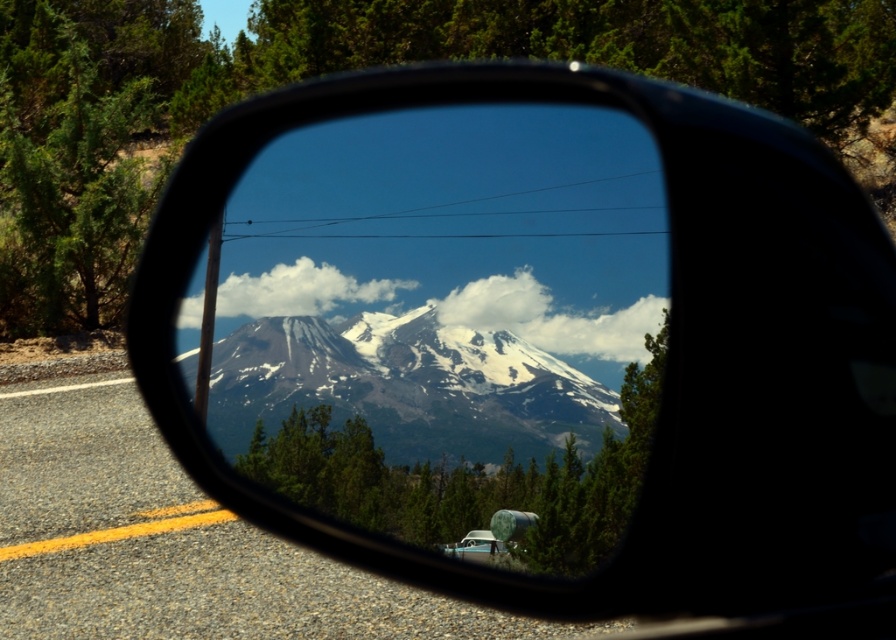
Question: From the image, what is the correct spatial relationship of snowy granite mountain at center in relation to white matte van at center?

Choices:
 (A) left
 (B) right

Answer: (A)

Question: Which object appears farthest from the camera in this image?

Choices:
 (A) white matte van at center
 (B) snowy granite mountain at center

Answer: (A)

Question: Does snowy granite mountain at center appear under white matte van at center?

Choices:
 (A) yes
 (B) no

Answer: (B)

Question: Is snowy granite mountain at center above white matte van at center?

Choices:
 (A) no
 (B) yes

Answer: (B)

Question: Which object is farther from the camera taking this photo?

Choices:
 (A) white matte van at center
 (B) snowy granite mountain at center

Answer: (A)